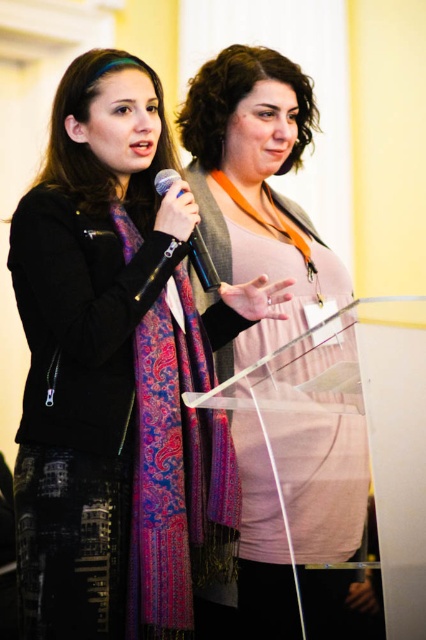
Who is more forward, (88, 476) or (333, 298)?

Point (88, 476) is in front.

Locate an element on the screen. The height and width of the screenshot is (640, 426). matte black jacket at left is located at coordinates (112, 396).

Who is taller, matte black jacket at left or paisley-patterned silk scarf at center?

matte black jacket at left is taller.

Can you confirm if matte black jacket at left is wider than paisley-patterned silk scarf at center?

Correct, the width of matte black jacket at left exceeds that of paisley-patterned silk scarf at center.

Which is in front, point (28, 308) or point (190, 540)?

Point (28, 308)

The image size is (426, 640). I want to click on matte black jacket at left, so click(x=112, y=396).

Does pink fabric at center appear on the left side of paisley-patterned silk scarf at center?

No, pink fabric at center is not to the left of paisley-patterned silk scarf at center.

Is point (218, 252) closer to camera compared to point (187, 429)?

No, (218, 252) is further to viewer.

Locate an element on the screen. pink fabric at center is located at coordinates (256, 186).

Image resolution: width=426 pixels, height=640 pixels. Find the location of `pink fabric at center`. pink fabric at center is located at coordinates (256, 186).